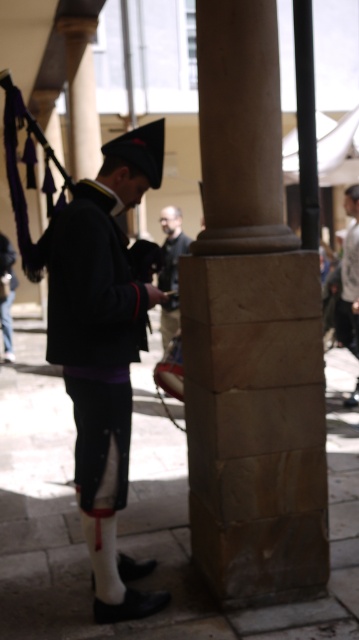
You are standing at the entrance of the courtyard and want to locate the brown stone pillar at center. According to the coordinates provided, where should you look relative to your current position?

The brown stone pillar at center is located at coordinates point 0.522 on the x axis and 0.699 on the y axis relative to your current position at the entrance.